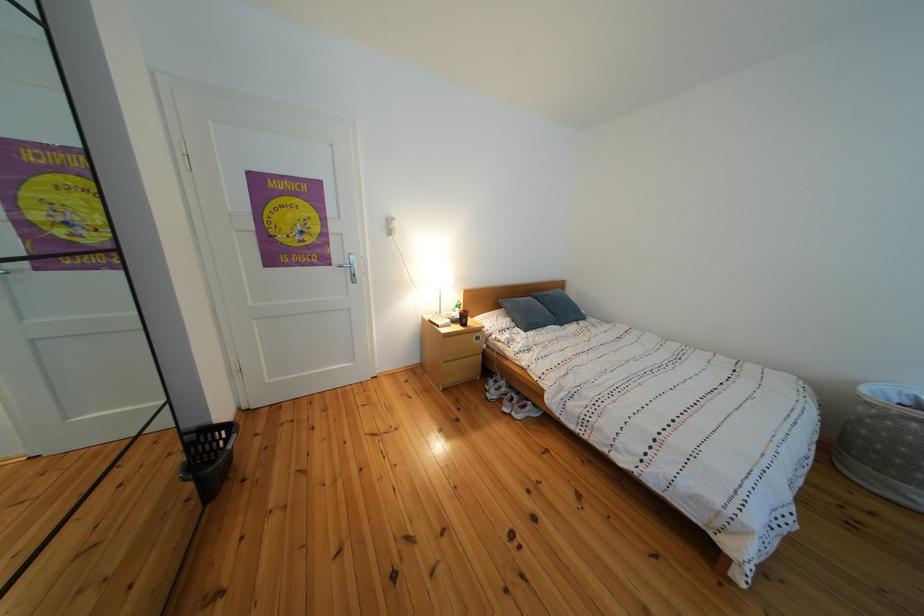
Describe the element at coordinates (884, 443) in the screenshot. I see `the grey laundry hamper` at that location.